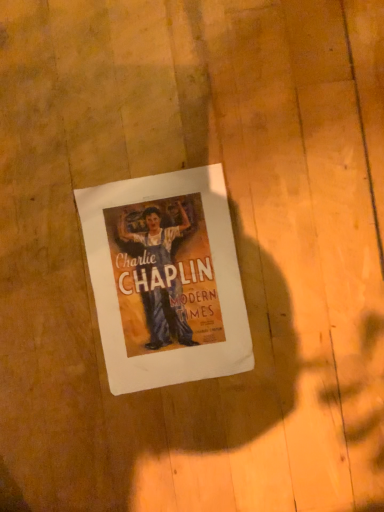
You are a GUI agent. You are given a task and a screenshot of the screen. Output one action in this format:
    pyautogui.click(x=<x>, y=<y>)
    Task: Click on the free space above white paper poster at center (from a real-world perspective)
    The image size is (384, 512).
    Given the screenshot: What is the action you would take?
    pyautogui.click(x=154, y=267)